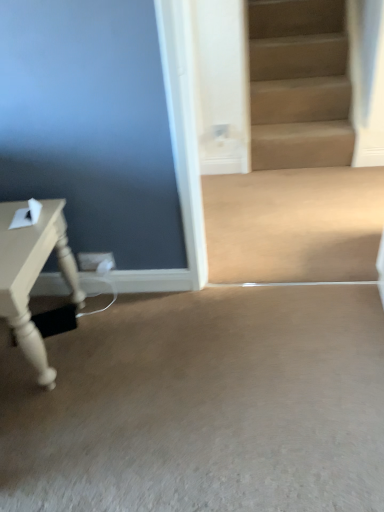
The image size is (384, 512). What are the coordinates of `vacant space to the right of matte white table at left` in the screenshot? It's located at (127, 347).